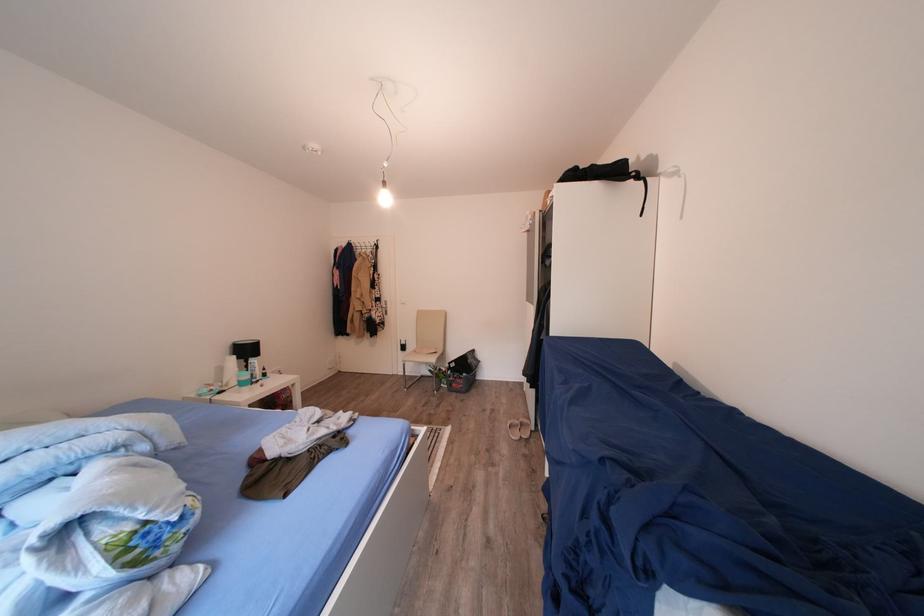
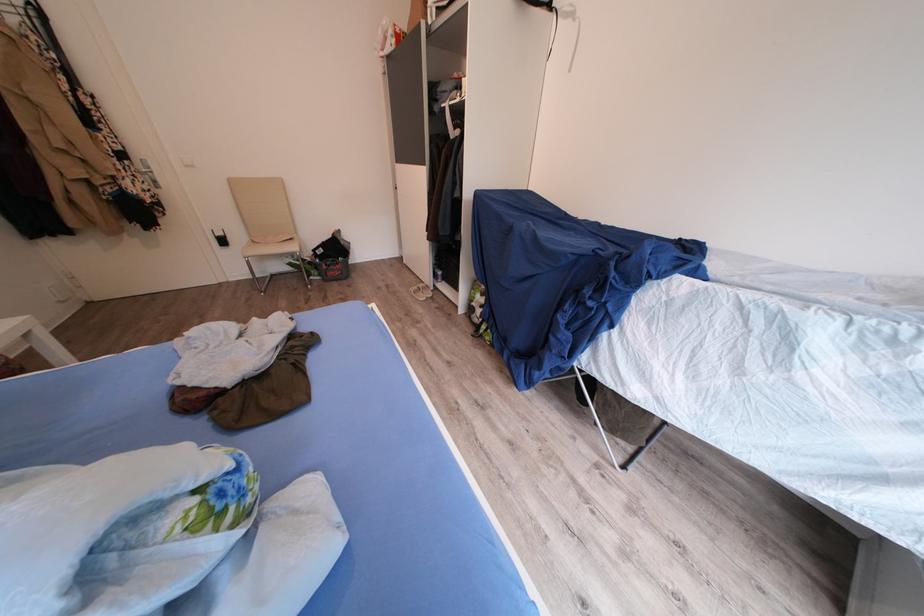
In the second image, find the point that corresponds to (456,390) in the first image.

(329, 281)